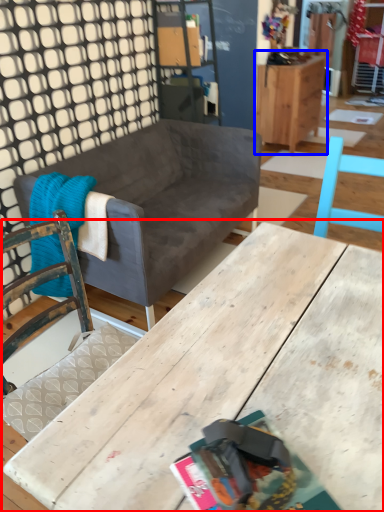
Question: Which object appears farthest to the camera in this image, table (highlighted by a red box) or cabinetry (highlighted by a blue box)?

Choices:
 (A) table
 (B) cabinetry

Answer: (B)